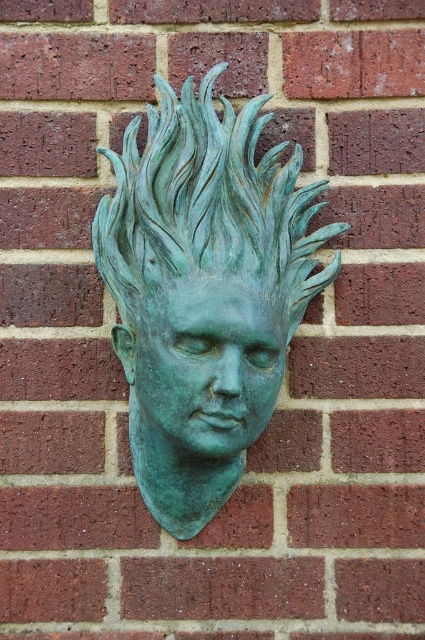
You are an art student analyzing the image of a bronze sculpture. You notice two elements labeled as the green patina bust at center and the green patina face at center. According to the spatial arrangement, which one is positioned to the right?

The green patina bust at center is positioned to the right of the green patina face at center.

You are an art conservator examining the bronze sculpture. You notice the green patina on both the green patina bust at center and the green patina face at center. Which part of the sculpture is taller?

The green patina bust at center is taller than the green patina face at center according to the description.